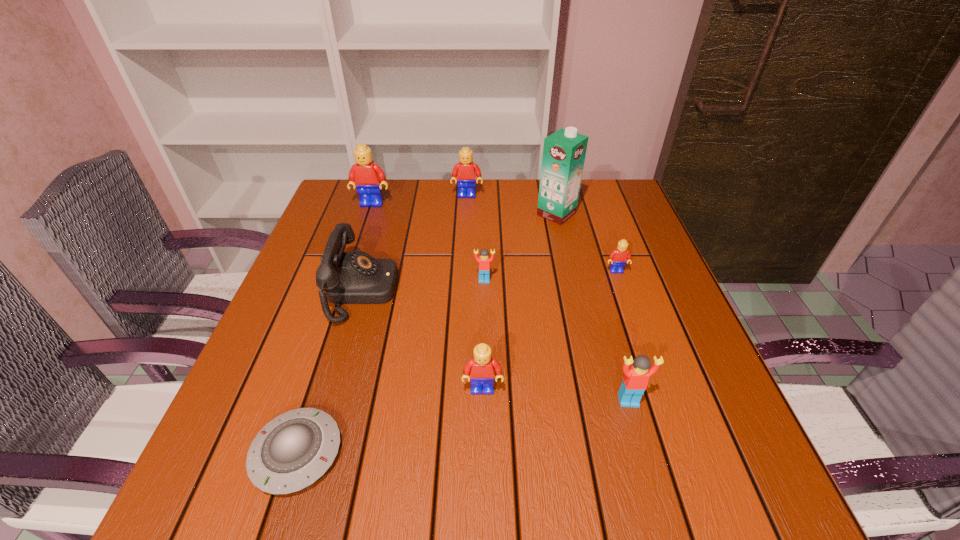
Identify the location of vacant point located 0.190m on the front-facing side of the nearest yellow Lego. This screenshot has height=540, width=960. (483, 506).

At what (x,y) coordinates should I click in order to perform the action: click on blank space located on the face of the third nearest Lego. Please return your answer as a coordinate pair (x, y). The height and width of the screenshot is (540, 960). Looking at the image, I should click on (485, 373).

Locate an element on the screen. This screenshot has height=540, width=960. vacant space located 0.050m on the front-facing side of the third farthest Lego is located at coordinates coord(622,288).

Locate an element on the screen. blank space located 0.260m on the back of the nearest object is located at coordinates (344, 307).

The height and width of the screenshot is (540, 960). What are the coordinates of `carton situated at the far edge` in the screenshot? It's located at (564, 151).

Locate an element on the screen. object present at the near edge is located at coordinates (292, 451).

Identify the location of Lego present at the left edge. (365, 175).

Locate an element on the screen. telephone that is at the left edge is located at coordinates (356, 277).

You are a GUI agent. You are given a task and a screenshot of the screen. Output one action in this format:
    pyautogui.click(x=<x>, y=<y>)
    Task: Click on the saucer that is at the left edge
    This screenshot has width=960, height=540.
    Given the screenshot: What is the action you would take?
    pyautogui.click(x=292, y=451)

Locate an element on the screen. object located at the far left corner is located at coordinates (365, 175).